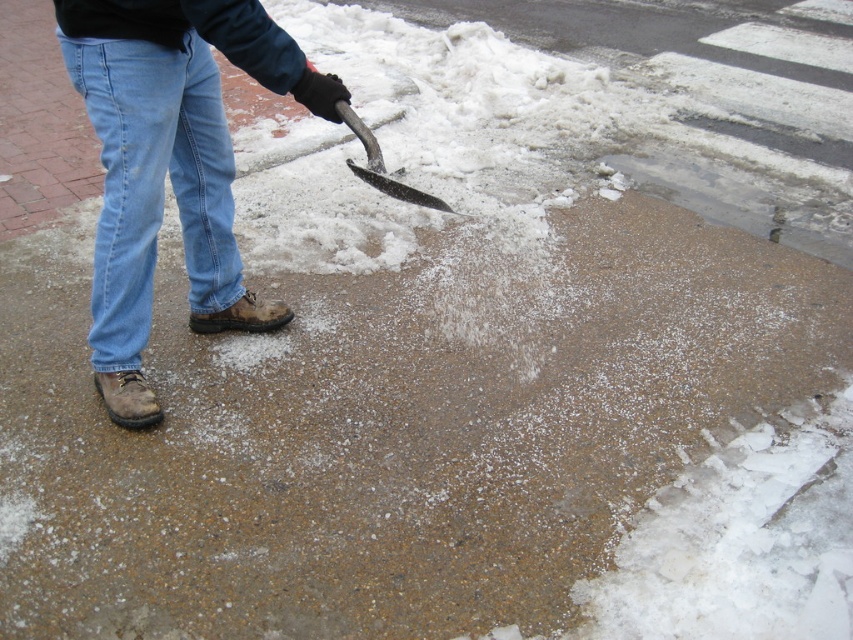
Does denim at left come in front of black metal shovel at center?

No, it is behind black metal shovel at center.

Is point (200, 152) positioned behind point (364, 134)?

Yes, point (200, 152) is behind point (364, 134).

Does point (143, 200) come in front of point (351, 124)?

No, it is not.

Locate an element on the screen. This screenshot has height=640, width=853. denim at left is located at coordinates (154, 182).